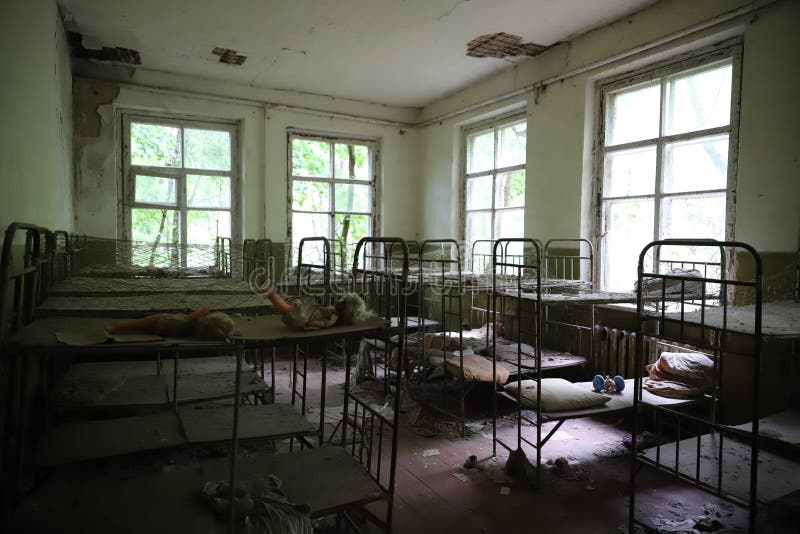
Locate an element on the screen. The image size is (800, 534). legs of doll is located at coordinates (134, 326), (273, 301).